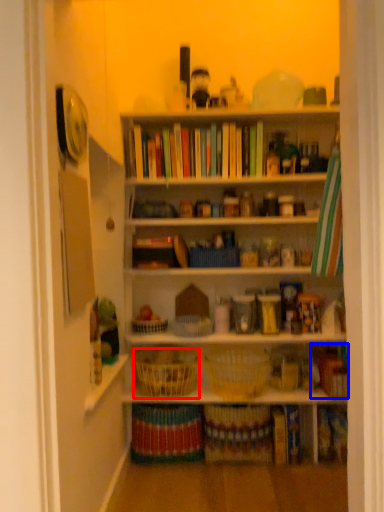
Question: Which object is further to the camera taking this photo, basket (highlighted by a red box) or book (highlighted by a blue box)?

Choices:
 (A) basket
 (B) book

Answer: (B)